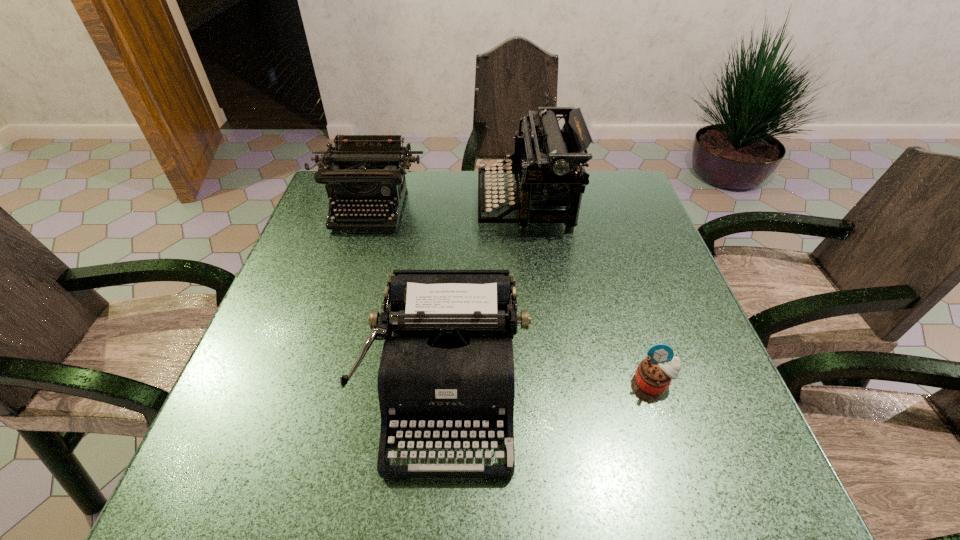
Where is `vacant area that lies between the shortest object and the nearest typewriter`? Image resolution: width=960 pixels, height=540 pixels. vacant area that lies between the shortest object and the nearest typewriter is located at coordinates (550, 387).

The height and width of the screenshot is (540, 960). In order to click on vacant space that is in between the rightmost object and the nearest typewriter in this screenshot , I will do `click(550, 387)`.

The image size is (960, 540). Find the location of `object that stands as the closest to the muffin`. object that stands as the closest to the muffin is located at coordinates (449, 366).

Identify the location of object that is the second closest to the shortest object. (550, 162).

At what (x,y) coordinates should I click in order to perform the action: click on typewriter that stands as the closest to the nearest typewriter. Please return your answer as a coordinate pair (x, y). Image resolution: width=960 pixels, height=540 pixels. Looking at the image, I should click on (550, 162).

Find the location of a particular element. the second closest typewriter to the tallest typewriter is located at coordinates (449, 366).

Locate an element on the screen. This screenshot has height=540, width=960. free location that satisfies the following two spatial constraints: 1. on the typing side of the tallest typewriter; 2. on the typing side of the nearest typewriter is located at coordinates (550, 390).

You are a GUI agent. You are given a task and a screenshot of the screen. Output one action in this format:
    pyautogui.click(x=<x>, y=<y>)
    Task: Click on the free location that satisfies the following two spatial constraints: 1. on the typing side of the tallest typewriter; 2. on the typing side of the nearest typewriter
    The image size is (960, 540).
    Given the screenshot: What is the action you would take?
    pyautogui.click(x=550, y=390)